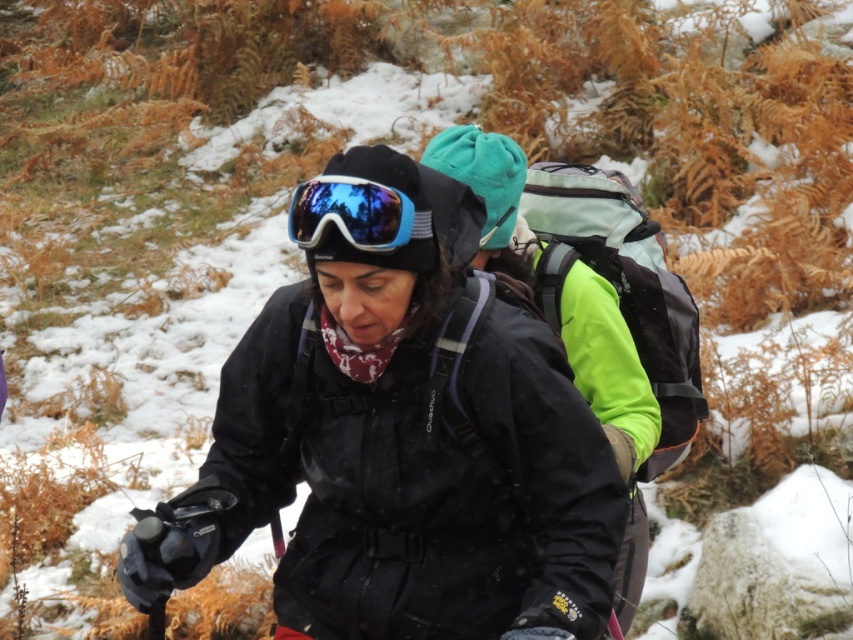
Question: Which point is closer to the camera?

Choices:
 (A) (312, 214)
 (B) (515, 620)

Answer: (A)

Question: In this image, where is matte black jacket at center located relative to shiny blue ski goggles at center?

Choices:
 (A) above
 (B) below

Answer: (B)

Question: Is matte black jacket at center to the right of shiny blue ski goggles at center from the viewer's perspective?

Choices:
 (A) no
 (B) yes

Answer: (A)

Question: Which of the following is the closest to the observer?

Choices:
 (A) (316, 236)
 (B) (189, 499)

Answer: (A)

Question: Is matte black jacket at center to the left of shiny blue ski goggles at center from the viewer's perspective?

Choices:
 (A) yes
 (B) no

Answer: (A)